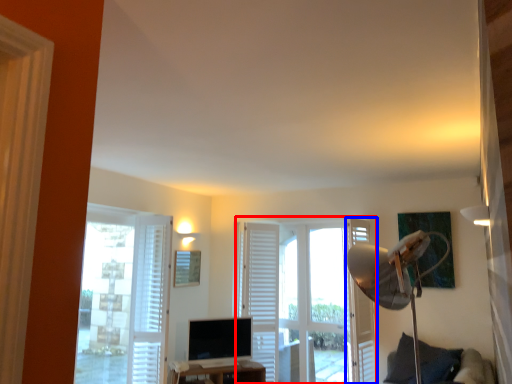
Question: Which object appears closest to the camera in this image, door (highlighted by a red box) or screen door (highlighted by a blue box)?

Choices:
 (A) door
 (B) screen door

Answer: (B)